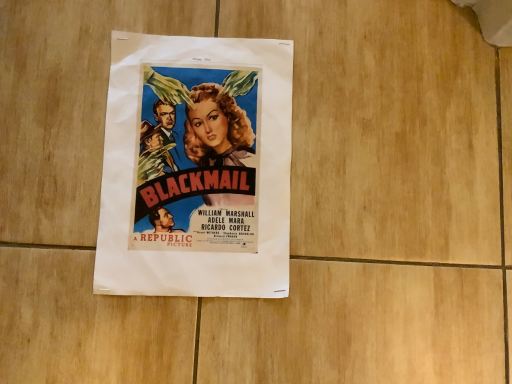
At what (x,y) coordinates should I click in order to perform the action: click on free space above matte paper poster at center (from a real-world perspective). Please return your answer as a coordinate pair (x, y). The image size is (512, 384). Looking at the image, I should click on (202, 158).